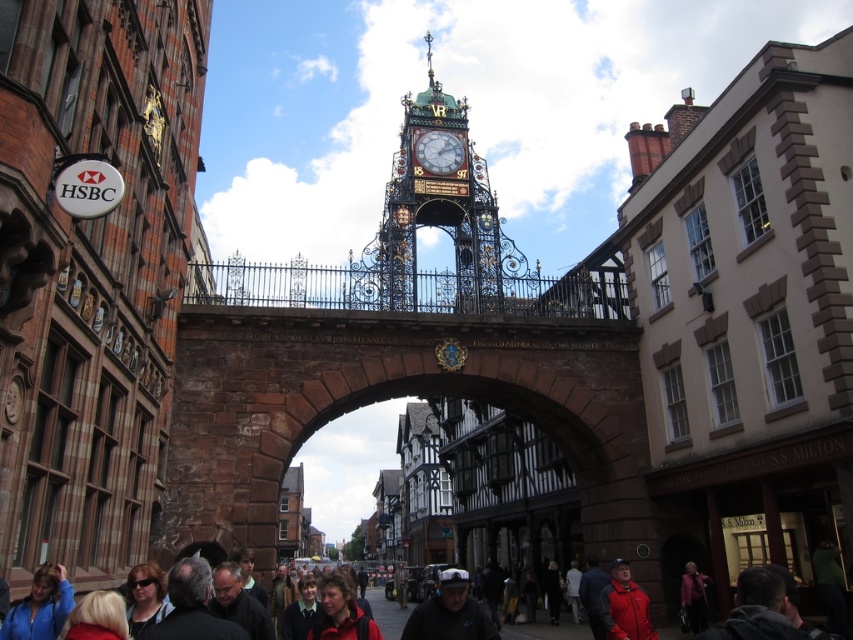
Question: Among these points, which one is nearest to the camera?

Choices:
 (A) (196, 636)
 (B) (396, 266)
 (C) (311, 632)
 (D) (447, 602)

Answer: (A)

Question: Can you confirm if dark gray jacket at lower right is thinner than matte pink coat at lower center?

Choices:
 (A) yes
 (B) no

Answer: (B)

Question: Is dark gray suit at lower left further to the viewer compared to white cap at center?

Choices:
 (A) no
 (B) yes

Answer: (A)

Question: From the image, what is the correct spatial relationship of dark gray jacket at lower right in relation to blue fleece jacket at lower left?

Choices:
 (A) left
 (B) right

Answer: (B)

Question: Based on their relative distances, which object is farther from the gold-plated ornate clock tower at center?

Choices:
 (A) matte black sunglasses at lower left
 (B) white cap at center

Answer: (A)

Question: Which point appears farthest from the camera in this image?

Choices:
 (A) (158, 593)
 (B) (496, 304)
 (C) (437, 138)

Answer: (C)